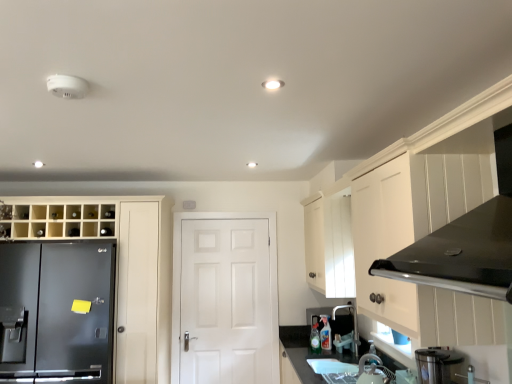
This screenshot has width=512, height=384. Find the location of `smooth granite countertop at lower center`. smooth granite countertop at lower center is located at coordinates (295, 336).

What do you see at coordinates (125, 272) in the screenshot? Image resolution: width=512 pixels, height=384 pixels. I see `matte black refrigerator at left` at bounding box center [125, 272].

Measure the distance between metallic silver faucet at lower right, the 1th appliance positioned from the bottom, and camera.

8.71 feet.

Measure the distance between point (375, 360) and camera.

The depth of point (375, 360) is 9.60 feet.

Where is `white matte door at center`? The image size is (512, 384). white matte door at center is located at coordinates (225, 298).

Find the location of `smooth granite countertop at lower center`. smooth granite countertop at lower center is located at coordinates (295, 336).

Is white matte door at center beside metallic silver faucet at lower right, arranged as the 1th appliance when viewed from the back?

No, white matte door at center is not beside metallic silver faucet at lower right, arranged as the 1th appliance when viewed from the back.

Considering the positions of objects white matte door at center and metallic silver faucet at lower right, which is the second appliance in top-to-bottom order, in the image provided, who is behind, white matte door at center or metallic silver faucet at lower right, which is the second appliance in top-to-bottom order,?

white matte door at center.

Which is behind, point (200, 277) or point (385, 382)?

Positioned behind is point (200, 277).

Is white matte door at center facing towards metallic silver faucet at lower right, which is the second appliance in top-to-bottom order?

Yes, white matte door at center is turned towards metallic silver faucet at lower right, which is the second appliance in top-to-bottom order.

Does matte silver faucet at lower center appear on the left side of metallic silver faucet at lower right, the 1th appliance positioned from the bottom?

No.

Which object is more forward, matte silver faucet at lower center or metallic silver faucet at lower right, arranged as the 1th appliance when viewed from the back?

metallic silver faucet at lower right, arranged as the 1th appliance when viewed from the back, is closer to the camera.

From their relative heights in the image, would you say matte silver faucet at lower center is taller or shorter than metallic silver faucet at lower right, the 1th appliance positioned from the bottom?

Considering their sizes, matte silver faucet at lower center has more height than metallic silver faucet at lower right, the 1th appliance positioned from the bottom.

Is stainless steel blender at lower right, the first appliance in the top-to-bottom sequence, facing towards white glossy sink at lower center?

No, stainless steel blender at lower right, the first appliance in the top-to-bottom sequence, does not turn towards white glossy sink at lower center.

From the image's perspective, relative to white glossy sink at lower center, is stainless steel blender at lower right, which ranks as the 2th appliance in back-to-front order, above or below?

Based on their image positions, stainless steel blender at lower right, which ranks as the 2th appliance in back-to-front order, is located above white glossy sink at lower center.

Considering the relative sizes of stainless steel blender at lower right, the second appliance when ordered from bottom to top, and white glossy sink at lower center in the image provided, is stainless steel blender at lower right, the second appliance when ordered from bottom to top, thinner than white glossy sink at lower center?

Indeed, stainless steel blender at lower right, the second appliance when ordered from bottom to top, has a lesser width compared to white glossy sink at lower center.

In terms of height, does stainless steel blender at lower right, which ranks as the 2th appliance in back-to-front order, look taller or shorter compared to white glossy sink at lower center?

Clearly, stainless steel blender at lower right, which ranks as the 2th appliance in back-to-front order, is taller compared to white glossy sink at lower center.

From a real-world perspective, is matte black refrigerator at left positioned above or below metallic silver faucet at lower right, arranged as the 1th appliance when viewed from the back?

From a real-world perspective, matte black refrigerator at left is physically above metallic silver faucet at lower right, arranged as the 1th appliance when viewed from the back.

Is matte black refrigerator at left surrounding metallic silver faucet at lower right, arranged as the 1th appliance when viewed from the back?

No, metallic silver faucet at lower right, arranged as the 1th appliance when viewed from the back, is not a part of matte black refrigerator at left.

Is matte black refrigerator at left wider than metallic silver faucet at lower right, the 1th appliance positioned from the bottom?

Indeed, matte black refrigerator at left has a greater width compared to metallic silver faucet at lower right, the 1th appliance positioned from the bottom.

Is matte black refrigerator at left looking in the opposite direction of metallic silver faucet at lower right, which is the second appliance in top-to-bottom order?

matte black refrigerator at left does not have its back to metallic silver faucet at lower right, which is the second appliance in top-to-bottom order.

Considering the positions of point (305, 346) and point (371, 356), is point (305, 346) closer or farther from the camera than point (371, 356)?

Point (305, 346) is farther from the camera than point (371, 356).

Between smooth granite countertop at lower center and metallic silver faucet at lower right, which is the second appliance in top-to-bottom order, which one appears on the right side from the viewer's perspective?

From the viewer's perspective, metallic silver faucet at lower right, which is the second appliance in top-to-bottom order, appears more on the right side.

From a real-world perspective, is smooth granite countertop at lower center positioned over metallic silver faucet at lower right, the 1th appliance positioned from the bottom, based on gravity?

No, from a real-world perspective, smooth granite countertop at lower center is not over metallic silver faucet at lower right, the 1th appliance positioned from the bottom

Which object is more forward, smooth granite countertop at lower center or metallic silver faucet at lower right, which ranks as the second appliance in front-to-back order?

metallic silver faucet at lower right, which ranks as the second appliance in front-to-back order, is more forward.

Choose the correct answer: Is matte black refrigerator at left inside clear plastic bottle at lower center or outside it?

matte black refrigerator at left is located beyond the bounds of clear plastic bottle at lower center.

Is matte black refrigerator at left turned away from clear plastic bottle at lower center?

No, matte black refrigerator at left is not facing the opposite direction of clear plastic bottle at lower center.

Considering the relative sizes of matte black refrigerator at left and clear plastic bottle at lower center in the image provided, is matte black refrigerator at left taller than clear plastic bottle at lower center?

Indeed, matte black refrigerator at left has a greater height compared to clear plastic bottle at lower center.

Visually, is matte black refrigerator at left positioned to the left or to the right of clear plastic bottle at lower center?

Clearly, matte black refrigerator at left is on the left of clear plastic bottle at lower center in the image.

Could you tell me if clear plastic bottle at lower center is turned towards matte black refrigerator at left?

No, clear plastic bottle at lower center is not aimed at matte black refrigerator at left.

Could matte black refrigerator at left be considered to be inside clear plastic bottle at lower center?

No, matte black refrigerator at left is not a part of clear plastic bottle at lower center.

The height and width of the screenshot is (384, 512). I want to click on cabinetry located above the clear plastic bottle at lower center (from a real-world perspective), so click(x=125, y=272).

In the scene shown: From a real-world perspective, which object stands above the other?

matte black refrigerator at left.

In the image, there is a metallic silver faucet at lower right, the 1th appliance positioned from the bottom. Where is `door below it (from the image's perspective)`? door below it (from the image's perspective) is located at coordinates (225, 298).

Find the location of `the 1st appliance above the matte silver faucet at lower center (from the image's perspective)`. the 1st appliance above the matte silver faucet at lower center (from the image's perspective) is located at coordinates (371, 371).

Which object lies nearer to the anchor point white glossy sink at lower center, smooth granite countertop at lower center or clear plastic bottle at lower center?

The object closer to white glossy sink at lower center is clear plastic bottle at lower center.

From the image, which object appears to be farther from smooth granite countertop at lower center, white glossy sink at lower center or matte silver faucet at lower center?

The object further to smooth granite countertop at lower center is white glossy sink at lower center.

Which object lies further to the anchor point white glossy sink at lower center, smooth granite countertop at lower center or matte black refrigerator at left?

Among the two, matte black refrigerator at left is located further to white glossy sink at lower center.

Estimate the real-world distances between objects in this image. Which object is closer to matte black refrigerator at left, white matte door at center or matte silver faucet at lower center?

white matte door at center.

Estimate the real-world distances between objects in this image. Which object is closer to smooth granite countertop at lower center, stainless steel blender at lower right, the first appliance from the front, or metallic silver faucet at lower right, arranged as the 1th appliance when viewed from the back?

The object closer to smooth granite countertop at lower center is metallic silver faucet at lower right, arranged as the 1th appliance when viewed from the back.

Based on the photo, when comparing their distances from metallic silver faucet at lower right, which is the second appliance in top-to-bottom order, does white matte door at center or stainless steel blender at lower right, the first appliance in the top-to-bottom sequence, seem closer?

stainless steel blender at lower right, the first appliance in the top-to-bottom sequence, is closer to metallic silver faucet at lower right, which is the second appliance in top-to-bottom order.

Estimate the real-world distances between objects in this image. Which object is further from matte silver faucet at lower center, metallic silver faucet at lower right, which ranks as the second appliance in front-to-back order, or matte black refrigerator at left?

Among the two, matte black refrigerator at left is located further to matte silver faucet at lower center.

When comparing their distances from smooth granite countertop at lower center, does white glossy sink at lower center or stainless steel blender at lower right, the first appliance from the front, seem further?

stainless steel blender at lower right, the first appliance from the front.

This screenshot has height=384, width=512. Find the location of `counter top situated between matte black refrigerator at left and stainless steel blender at lower right, which ranks as the 2th appliance in back-to-front order, from left to right`. counter top situated between matte black refrigerator at left and stainless steel blender at lower right, which ranks as the 2th appliance in back-to-front order, from left to right is located at coordinates (295, 336).

At what (x,y) coordinates should I click in order to perform the action: click on counter top located between stainless steel blender at lower right, the second appliance when ordered from bottom to top, and clear plastic bottle at lower center in the depth direction. Please return your answer as a coordinate pair (x, y). The width and height of the screenshot is (512, 384). Looking at the image, I should click on (295, 336).

What are the coordinates of `door located between matte black refrigerator at left and stainless steel blender at lower right, which ranks as the 2th appliance in back-to-front order, in the left-right direction` in the screenshot? It's located at (225, 298).

This screenshot has height=384, width=512. Find the location of `sink between metallic silver faucet at lower right, the 1th appliance positioned from the bottom, and matte silver faucet at lower center in the front-back direction`. sink between metallic silver faucet at lower right, the 1th appliance positioned from the bottom, and matte silver faucet at lower center in the front-back direction is located at coordinates coord(351,370).